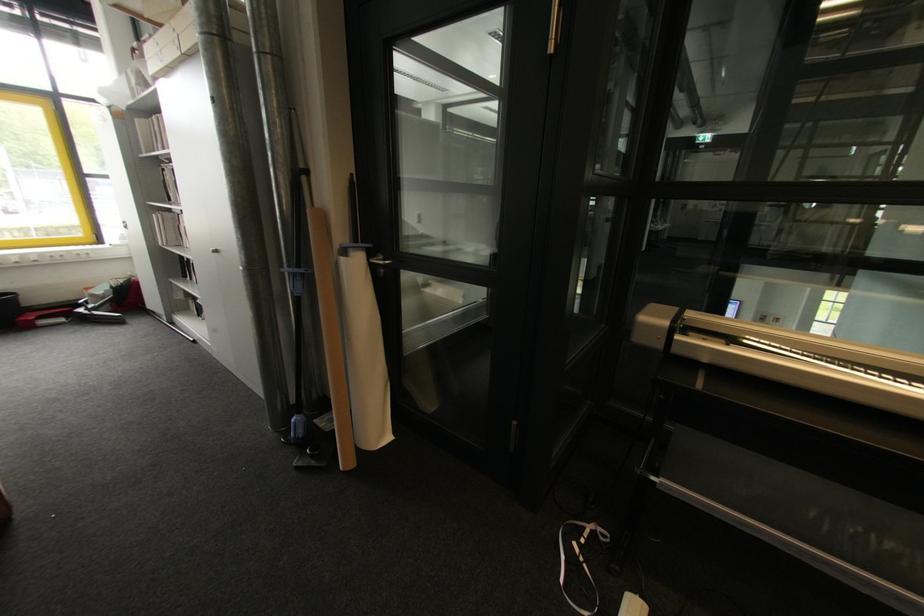
In order to click on cabinet door handle in this screenshot , I will do `click(382, 262)`.